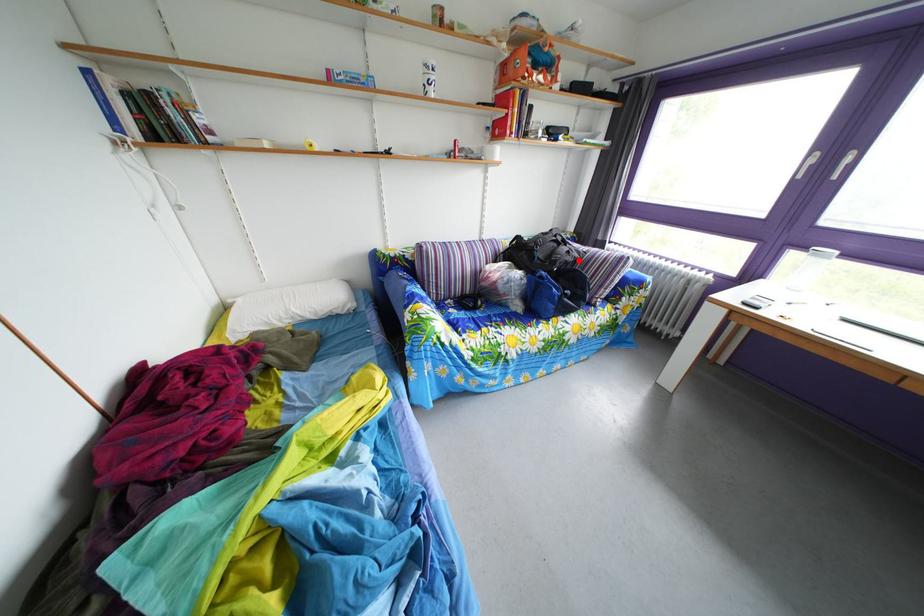
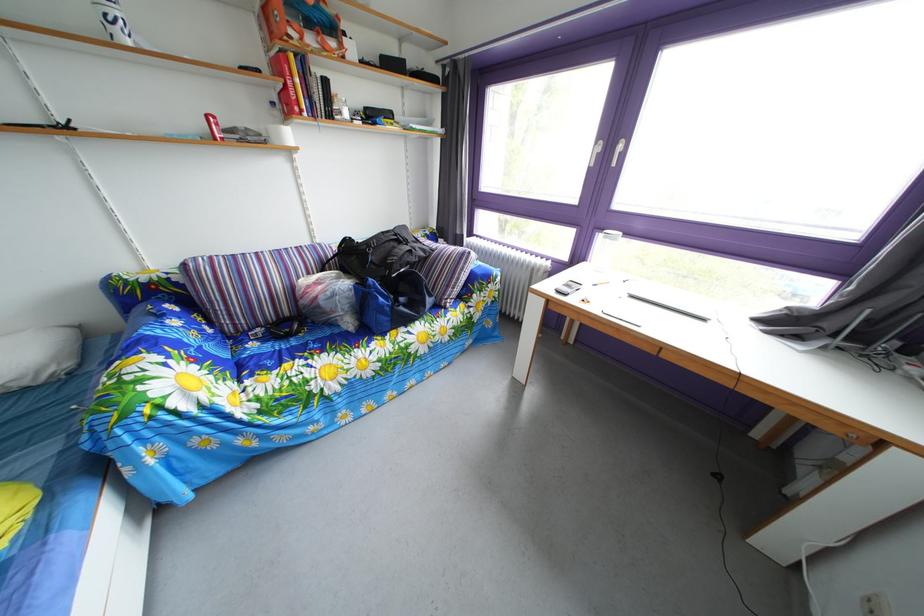
The point at the highlighted location is marked in the first image. Where is the corresponding point in the second image?

(421, 260)